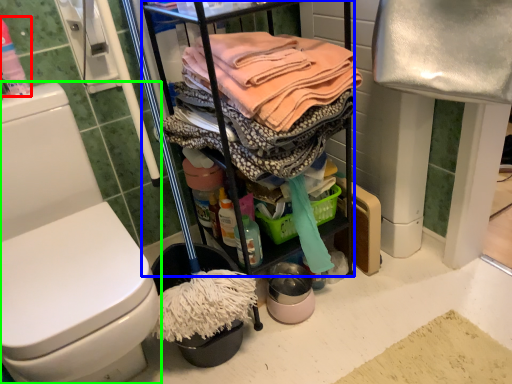
Question: Which object is positioned farthest from cleaning products (highlighted by a red box)? Select from cabinetry (highlighted by a blue box) and toilet (highlighted by a green box).

Choices:
 (A) cabinetry
 (B) toilet

Answer: (A)